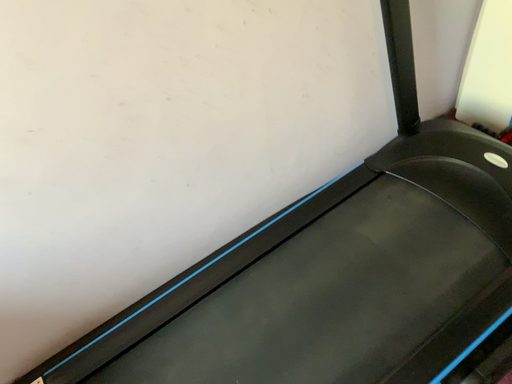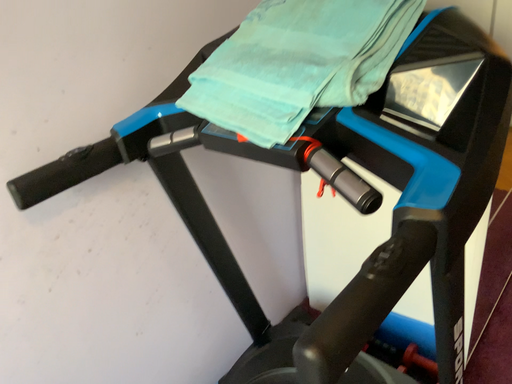
Question: How did the camera likely rotate when shooting the video?

Choices:
 (A) rotated upward
 (B) rotated downward

Answer: (A)